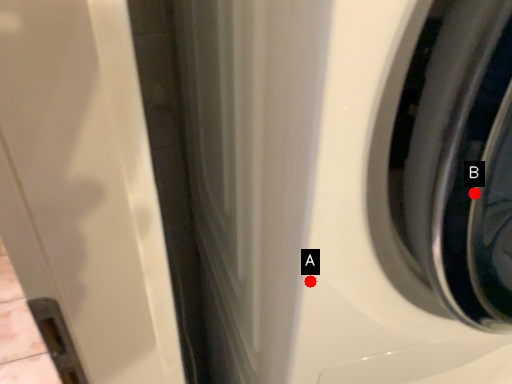
Question: Two points are circled on the image, labeled by A and B beside each circle. Which point is farther from the camera taking this photo?

Choices:
 (A) A is further
 (B) B is further

Answer: (A)